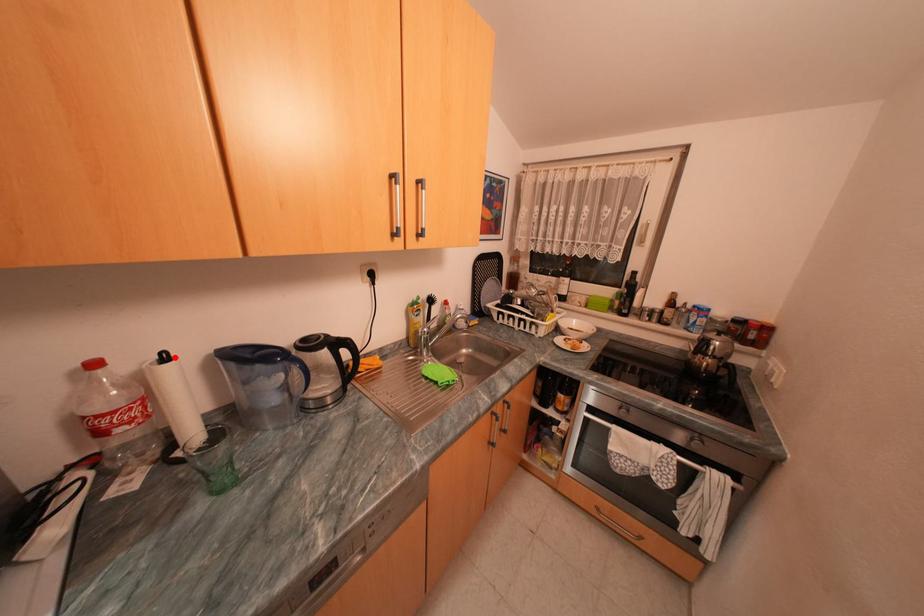
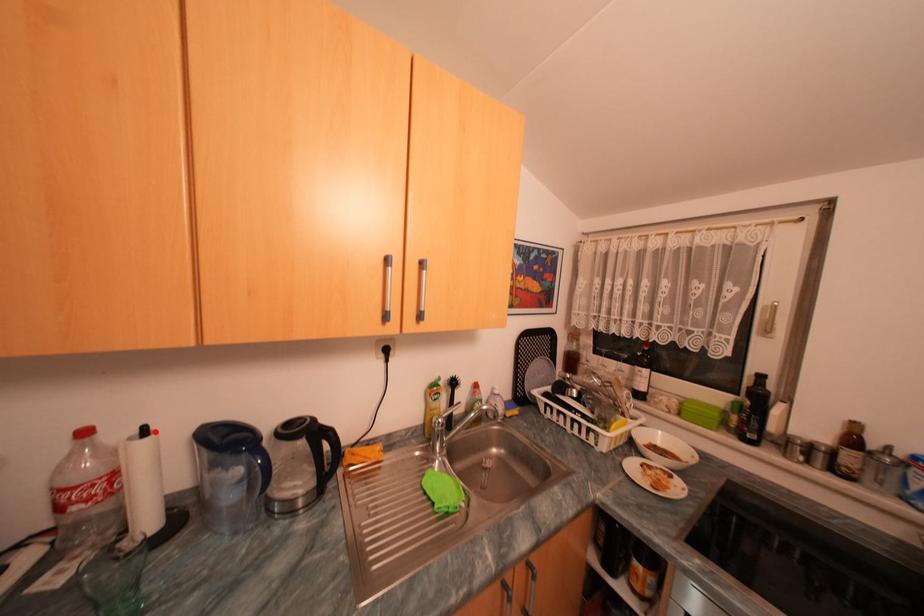
I am providing you with two images of the same scene from different viewpoints. A red point is marked on the first image and another point is marked on the second image. Is the marked point in image1 the same physical position as the marked point in image2?

Yes